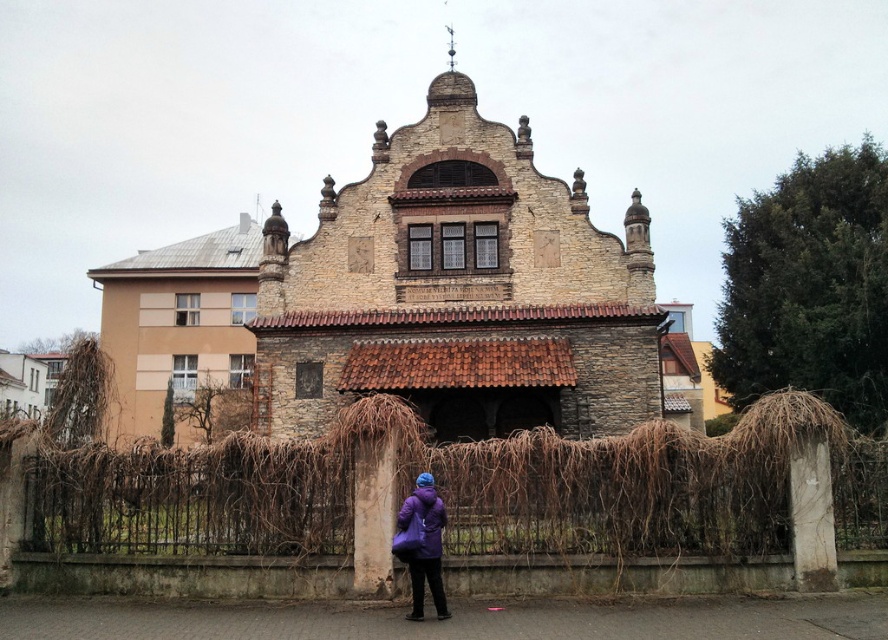
Question: Which of the following is the closest to the observer?

Choices:
 (A) brown wicker fence at lower center
 (B) purple synthetic coat at lower center
 (C) stone textured church at center

Answer: (B)

Question: Can you confirm if purple matte jacket at lower center is wider than purple synthetic coat at lower center?

Choices:
 (A) yes
 (B) no

Answer: (B)

Question: Which object is positioned closest to the purple matte jacket at lower center?

Choices:
 (A) brown wicker fence at lower center
 (B) stone textured church at center
 (C) purple synthetic coat at lower center

Answer: (C)

Question: Is stone textured church at center positioned at the back of purple synthetic coat at lower center?

Choices:
 (A) no
 (B) yes

Answer: (B)

Question: Is brown wicker fence at lower center closer to camera compared to purple synthetic coat at lower center?

Choices:
 (A) no
 (B) yes

Answer: (A)

Question: Which object is the closest to the brown wicker fence at lower center?

Choices:
 (A) purple matte jacket at lower center
 (B) purple synthetic coat at lower center
 (C) stone textured church at center

Answer: (B)